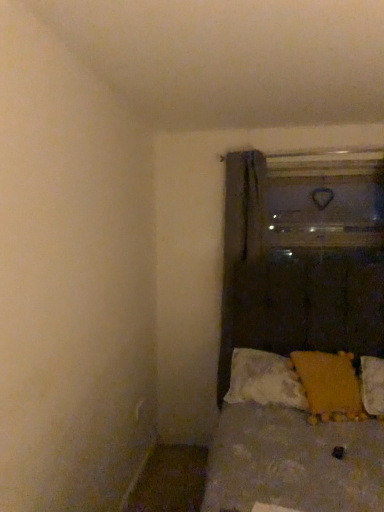
Question: Considering the positions of point click(x=339, y=404) and point click(x=235, y=369), is point click(x=339, y=404) closer or farther from the camera than point click(x=235, y=369)?

Choices:
 (A) farther
 (B) closer

Answer: (B)

Question: Looking at their shapes, would you say yellow fabric pillow at lower right, the first pillow viewed from the right, is wider or thinner than white textured pillow at lower right, the first pillow positioned from the left?

Choices:
 (A) thin
 (B) wide

Answer: (B)

Question: Estimate the real-world distances between objects in this image. Which object is closer to the white textured pillow at lower right, the 2th pillow from the right?

Choices:
 (A) transparent glass door at upper right
 (B) dark gray fabric curtain at center
 (C) yellow fabric pillow at lower right, the first pillow viewed from the right

Answer: (C)

Question: Which object is positioned farthest from the dark gray fabric curtain at center?

Choices:
 (A) white textured pillow at lower right, the first pillow positioned from the left
 (B) yellow fabric pillow at lower right, the first pillow viewed from the right
 (C) transparent glass door at upper right

Answer: (B)